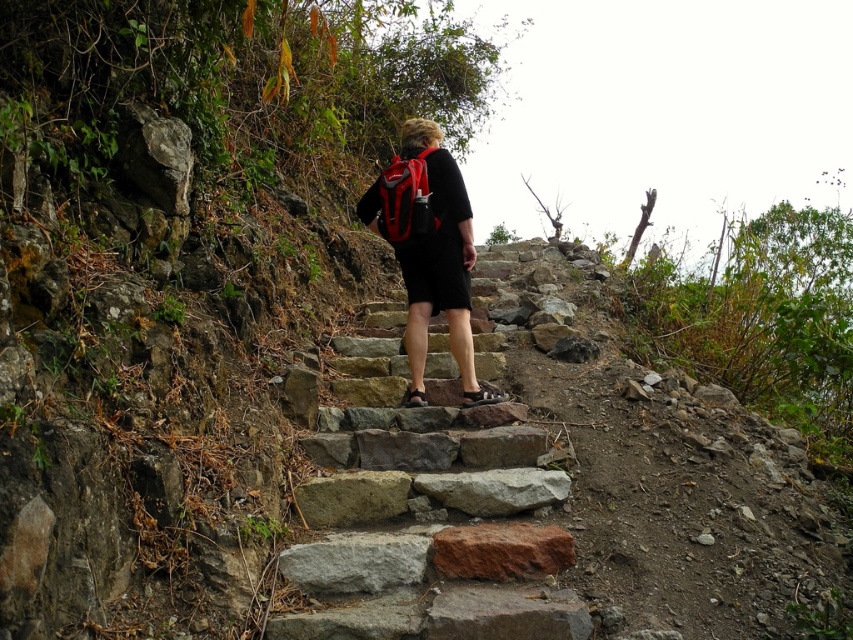
Is gray stone stairs at center further to camera compared to matte black backpack at center?

No, it is not.

Does point (566, 566) lie in front of point (425, 317)?

Yes, point (566, 566) is in front of point (425, 317).

What do you see at coordinates (427, 522) in the screenshot? I see `gray stone stairs at center` at bounding box center [427, 522].

Find the location of a particular element. gray stone stairs at center is located at coordinates (427, 522).